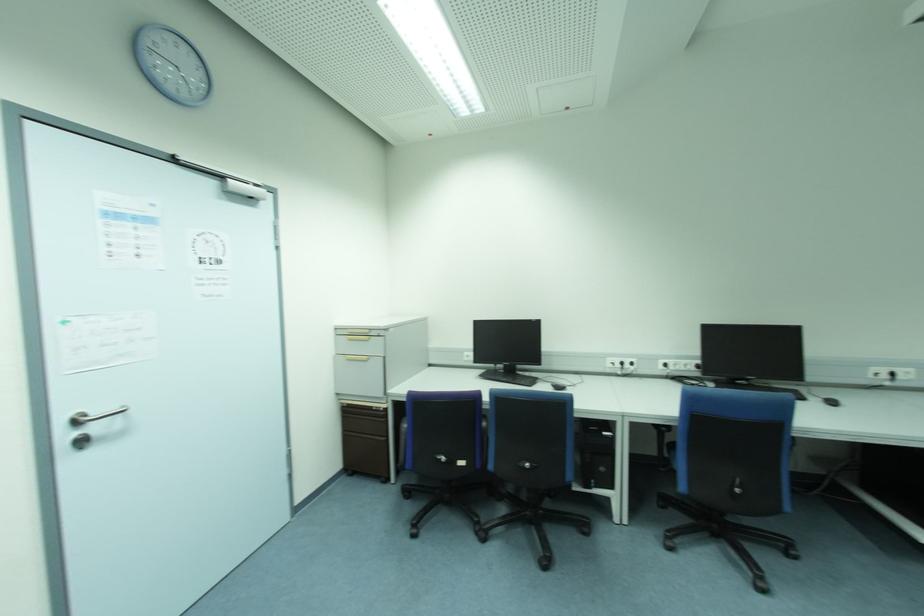
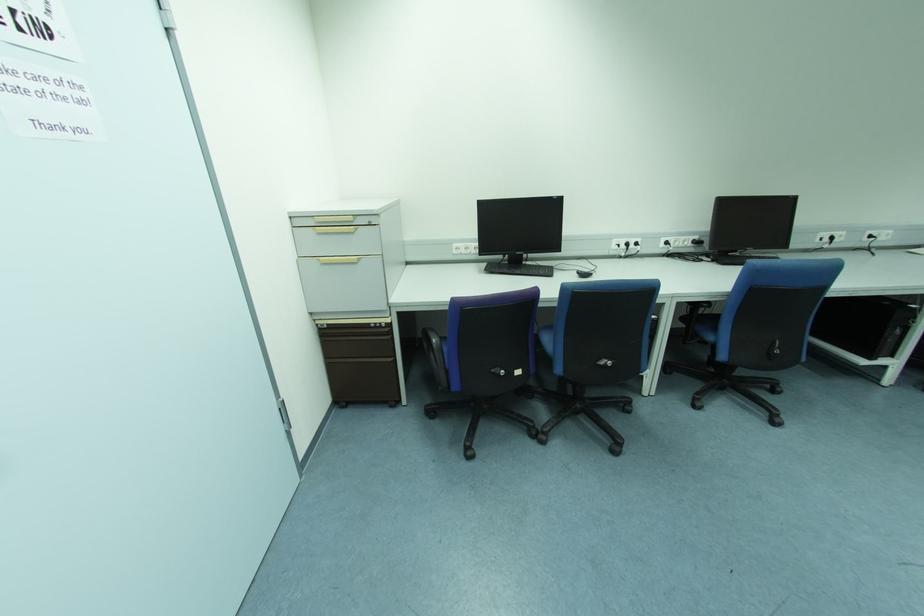
In the second image, find the point that corresponds to (368,331) in the first image.

(350, 219)